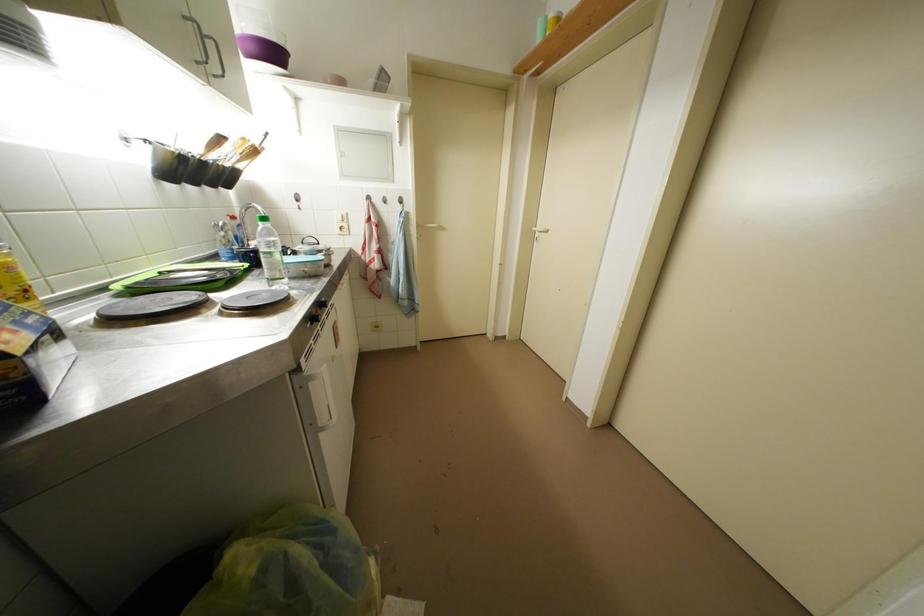
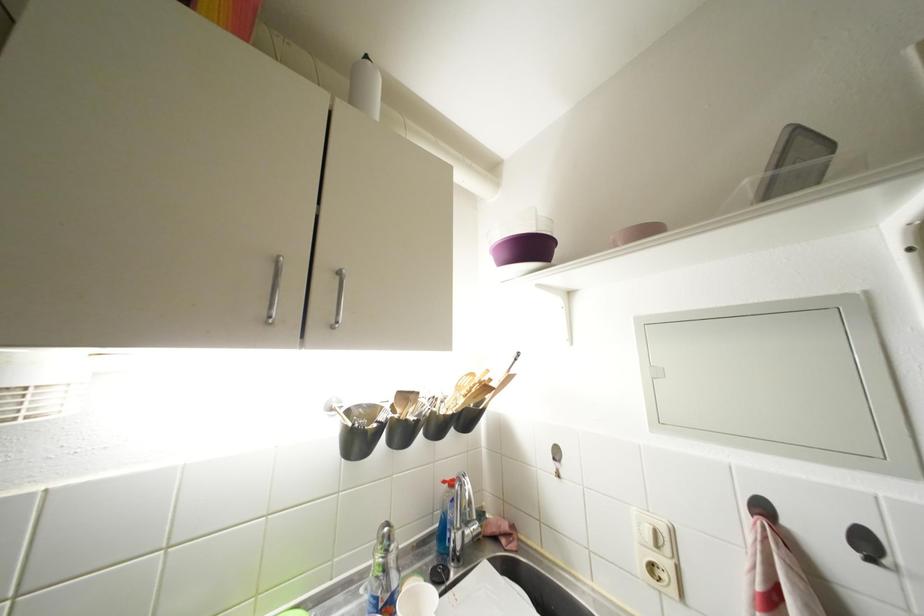
Find the pixel in the second image that matches [259,53] in the first image.

(512, 259)